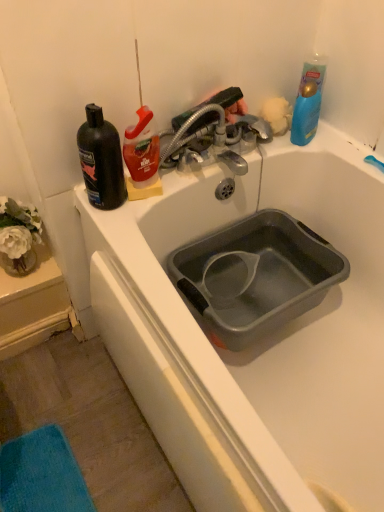
At what (x,y) coordinates should I click in order to perform the action: click on black matte bottle at left. Please return your answer as a coordinate pair (x, y). Looking at the image, I should click on (101, 160).

Describe the element at coordinates (101, 160) in the screenshot. I see `black matte bottle at left` at that location.

Locate an element on the screen. Image resolution: width=384 pixels, height=512 pixels. blue glossy bottle at upper right is located at coordinates (308, 101).

The height and width of the screenshot is (512, 384). Describe the element at coordinates (308, 101) in the screenshot. I see `blue glossy bottle at upper right` at that location.

The height and width of the screenshot is (512, 384). Describe the element at coordinates (277, 114) in the screenshot. I see `fluffy yellow sponge at upper right` at that location.

What do you see at coordinates (256, 276) in the screenshot? I see `gray plastic basin at center` at bounding box center [256, 276].

Find the location of a particular element. metallic silver faucet at upper center is located at coordinates pos(206,148).

Locate an element on the screen. The image size is (384, 512). black matte bottle at left is located at coordinates (101, 160).

Measure the distance from blue glossy bottle at upper right to black matte bottle at left.

blue glossy bottle at upper right and black matte bottle at left are 20.40 inches apart.

From the image's perspective, relative to black matte bottle at left, is blue glossy bottle at upper right above or below?

Based on their image positions, blue glossy bottle at upper right is located above black matte bottle at left.

Considering the positions of points (321, 93) and (89, 135), is point (321, 93) closer to camera compared to point (89, 135)?

No, (321, 93) is further to viewer.

Would you say black matte bottle at left is part of blue glossy bottle at upper right's contents?

Definitely not — black matte bottle at left is not inside blue glossy bottle at upper right.

Considering the sizes of objects metallic silver faucet at upper center and blue glossy bottle at upper right in the image provided, who is shorter, metallic silver faucet at upper center or blue glossy bottle at upper right?

Standing shorter between the two is metallic silver faucet at upper center.

At what (x,y) coordinates should I click in order to perform the action: click on cleaning product that is under the metallic silver faucet at upper center (from a real-world perspective). Please return your answer as a coordinate pair (x, y). This screenshot has width=384, height=512. Looking at the image, I should click on (308, 101).

Considering the relative positions of metallic silver faucet at upper center and blue glossy bottle at upper right in the image provided, is metallic silver faucet at upper center to the right of blue glossy bottle at upper right from the viewer's perspective?

Incorrect, metallic silver faucet at upper center is not on the right side of blue glossy bottle at upper right.

In the scene shown: In terms of size, does metallic silver faucet at upper center appear bigger or smaller than blue glossy bottle at upper right?

Clearly, metallic silver faucet at upper center is larger in size than blue glossy bottle at upper right.

Between point (195, 134) and point (277, 292), which one is positioned behind?

The point (277, 292) is farther from the camera.

Is metallic silver faucet at upper center positioned with its back to gray plastic basin at center?

metallic silver faucet at upper center is not turned away from gray plastic basin at center.

Which object is further away from the camera taking this photo, metallic silver faucet at upper center or gray plastic basin at center?

metallic silver faucet at upper center is behind.

Can you tell me how much metallic silver faucet at upper center and gray plastic basin at center differ in facing direction?

The facing directions of metallic silver faucet at upper center and gray plastic basin at center are 0.645 degrees apart.

Is fluffy yellow sponge at upper right located within black matte bottle at left?

No, fluffy yellow sponge at upper right is not surrounded by black matte bottle at left.

Where is `flower lying above the black matte bottle at left (from the image's perspective)`? flower lying above the black matte bottle at left (from the image's perspective) is located at coordinates (277, 114).

Is the position of black matte bottle at left more distant than that of fluffy yellow sponge at upper right?

No, black matte bottle at left is closer to the camera.

Is black matte bottle at left to the right of fluffy yellow sponge at upper right from the viewer's perspective?

In fact, black matte bottle at left is to the left of fluffy yellow sponge at upper right.

Which object is positioned more to the right, blue glossy bottle at upper right or metallic silver faucet at upper center?

blue glossy bottle at upper right.

Considering the relative sizes of blue glossy bottle at upper right and metallic silver faucet at upper center in the image provided, is blue glossy bottle at upper right taller than metallic silver faucet at upper center?

Yes.

From the picture: Considering the sizes of objects blue glossy bottle at upper right and metallic silver faucet at upper center in the image provided, who is thinner, blue glossy bottle at upper right or metallic silver faucet at upper center?

With smaller width is blue glossy bottle at upper right.

Which of these two, gray plastic basin at center or metallic silver faucet at upper center, is bigger?

gray plastic basin at center is bigger.

Considering the positions of points (302, 236) and (183, 163), is point (302, 236) closer to camera compared to point (183, 163)?

No.

Can you confirm if gray plastic basin at center is wider than metallic silver faucet at upper center?

Indeed, gray plastic basin at center has a greater width compared to metallic silver faucet at upper center.

Are gray plastic basin at center and metallic silver faucet at upper center far apart?

No, gray plastic basin at center is not far away from metallic silver faucet at upper center.

From the image's perspective, is blue glossy bottle at upper right below fluffy yellow sponge at upper right?

Indeed, from the image's perspective, blue glossy bottle at upper right is shown beneath fluffy yellow sponge at upper right.

Would you consider blue glossy bottle at upper right to be distant from fluffy yellow sponge at upper right?

They are positioned close to each other.

Can we say blue glossy bottle at upper right lies outside fluffy yellow sponge at upper right?

blue glossy bottle at upper right is positioned outside fluffy yellow sponge at upper right.

This screenshot has height=512, width=384. Find the location of `mouthwash positioned vertically above the blue glossy bottle at upper right (from a real-world perspective)`. mouthwash positioned vertically above the blue glossy bottle at upper right (from a real-world perspective) is located at coordinates (101, 160).

You are a GUI agent. You are given a task and a screenshot of the screen. Output one action in this format:
    pyautogui.click(x=<x>, y=<y>)
    Task: Click on the tap lying on the left of blue glossy bottle at upper right
    The image size is (384, 512).
    Given the screenshot: What is the action you would take?
    pyautogui.click(x=206, y=148)

Estimate the real-world distances between objects in this image. Which object is further from metallic silver faucet at upper center, fluffy yellow sponge at upper right or blue glossy bottle at upper right?

blue glossy bottle at upper right.

When comparing their distances from blue glossy bottle at upper right, does metallic silver faucet at upper center or black matte bottle at left seem further?

Based on the image, black matte bottle at left appears to be further to blue glossy bottle at upper right.

Considering their positions, is fluffy yellow sponge at upper right positioned closer to metallic silver faucet at upper center than black matte bottle at left?

Based on the image, fluffy yellow sponge at upper right appears to be nearer to metallic silver faucet at upper center.

Estimate the real-world distances between objects in this image. Which object is further from gray plastic basin at center, metallic silver faucet at upper center or fluffy yellow sponge at upper right?

fluffy yellow sponge at upper right is positioned further to the anchor gray plastic basin at center.

Which object lies further to the anchor point blue glossy bottle at upper right, black matte bottle at left or gray plastic basin at center?

black matte bottle at left.

Which object lies nearer to the anchor point blue glossy bottle at upper right, fluffy yellow sponge at upper right or black matte bottle at left?

fluffy yellow sponge at upper right is positioned closer to the anchor blue glossy bottle at upper right.

Consider the image. From the image, which object appears to be farther from gray plastic basin at center, black matte bottle at left or fluffy yellow sponge at upper right?

black matte bottle at left is positioned further to the anchor gray plastic basin at center.

When comparing their distances from metallic silver faucet at upper center, does black matte bottle at left or gray plastic basin at center seem closer?

black matte bottle at left.

In order to click on sink between black matte bottle at left and fluffy yellow sponge at upper right in the horizontal direction in this screenshot , I will do `click(256, 276)`.

In order to click on mouthwash between metallic silver faucet at upper center and gray plastic basin at center vertically in this screenshot , I will do `click(101, 160)`.

The width and height of the screenshot is (384, 512). In order to click on sink between black matte bottle at left and blue glossy bottle at upper right in this screenshot , I will do `click(256, 276)`.

Find the location of a particular element. The width and height of the screenshot is (384, 512). flower located between metallic silver faucet at upper center and blue glossy bottle at upper right in the left-right direction is located at coordinates (277, 114).